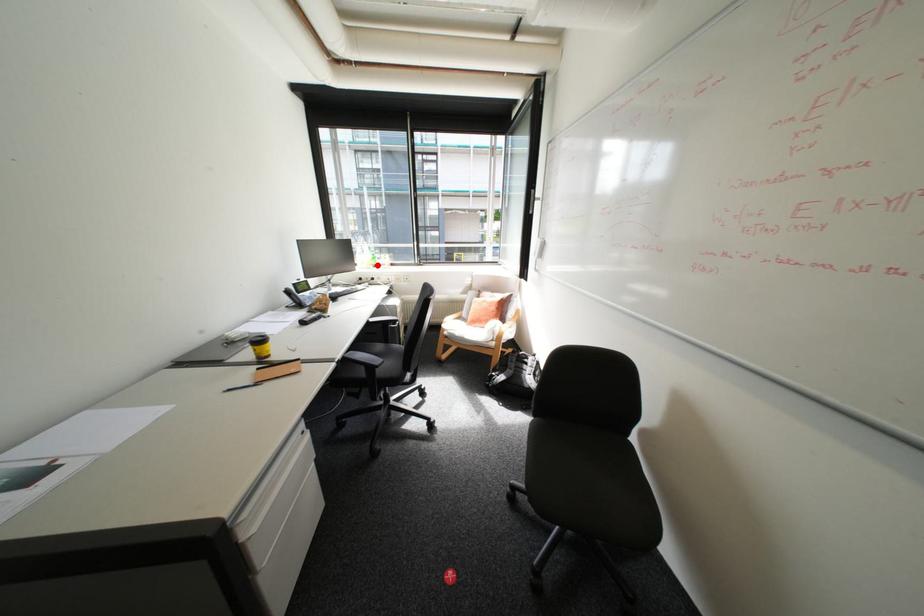
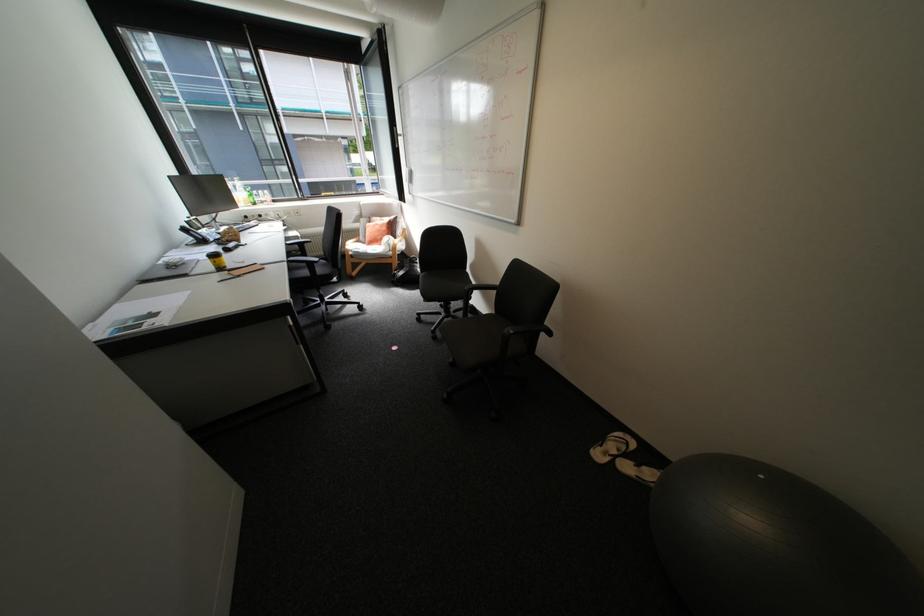
The point at the highlighted location is marked in the first image. Where is the corresponding point in the second image?

(256, 204)